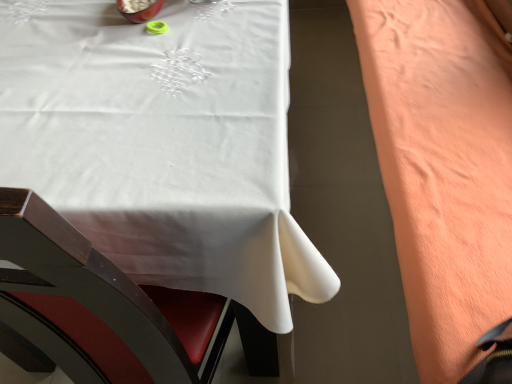
Question: In the image, is coral fleece blanket at right positioned in front of or behind white fabric table at upper left?

Choices:
 (A) front
 (B) behind

Answer: (B)

Question: Based on their sizes in the image, would you say coral fleece blanket at right is bigger or smaller than white fabric table at upper left?

Choices:
 (A) big
 (B) small

Answer: (B)

Question: Considering the positions of coral fleece blanket at right and white fabric table at upper left in the image, is coral fleece blanket at right taller or shorter than white fabric table at upper left?

Choices:
 (A) tall
 (B) short

Answer: (B)

Question: Is white fabric table at upper left wider or thinner than coral fleece blanket at right?

Choices:
 (A) thin
 (B) wide

Answer: (B)

Question: Is white fabric table at upper left to the left or to the right of coral fleece blanket at right in the image?

Choices:
 (A) right
 (B) left

Answer: (B)

Question: Is point 121,158 positioned closer to the camera than point 362,19?

Choices:
 (A) closer
 (B) farther

Answer: (A)

Question: Is white fabric table at upper left in front of or behind coral fleece blanket at right in the image?

Choices:
 (A) behind
 (B) front

Answer: (B)